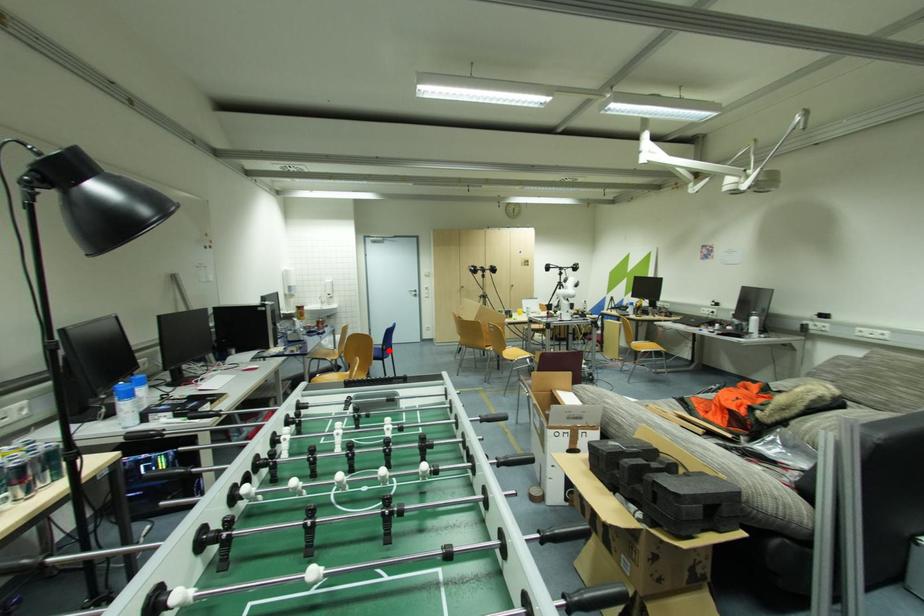
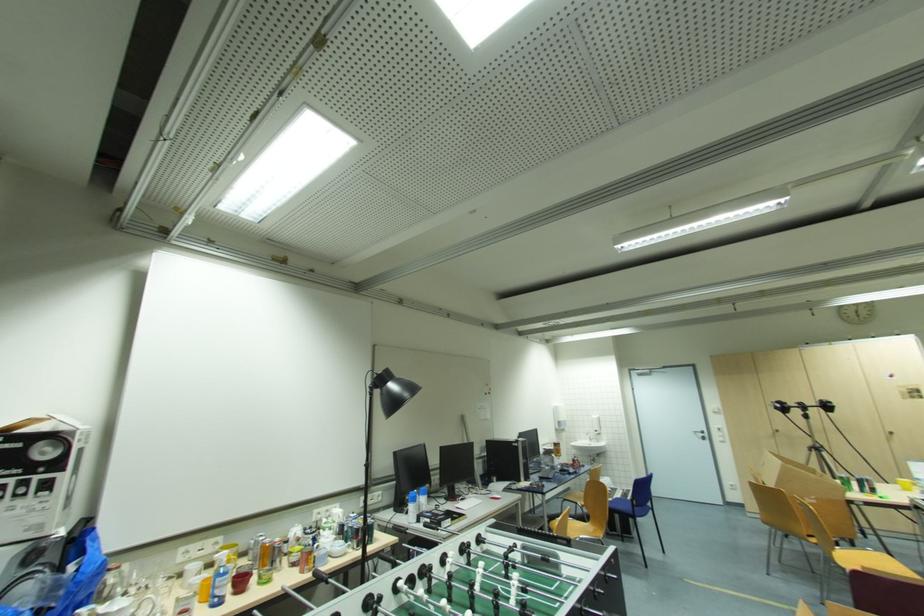
Locate, in the second image, the point that corresponds to the highlighted location in the first image.

(639, 506)